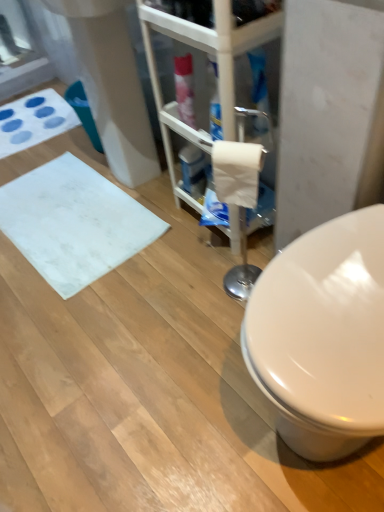
Question: Does white matte bath mat at lower left, the 1th bath mat in the bottom-to-top sequence, appear on the left side of white matte toilet paper at center?

Choices:
 (A) no
 (B) yes

Answer: (B)

Question: Considering the relative sizes of white matte bath mat at lower left, the 1th bath mat viewed from the front, and white matte toilet paper at center in the image provided, is white matte bath mat at lower left, the 1th bath mat viewed from the front, shorter than white matte toilet paper at center?

Choices:
 (A) yes
 (B) no

Answer: (A)

Question: From the image's perspective, is white matte bath mat at lower left, arranged as the second bath mat when viewed from the top, located above white matte toilet paper at center?

Choices:
 (A) yes
 (B) no

Answer: (B)

Question: Considering the relative sizes of white matte bath mat at lower left, the 1th bath mat in the bottom-to-top sequence, and white matte toilet paper at center in the image provided, is white matte bath mat at lower left, the 1th bath mat in the bottom-to-top sequence, smaller than white matte toilet paper at center?

Choices:
 (A) yes
 (B) no

Answer: (B)

Question: Is white matte toilet paper at center completely or partially inside white matte bath mat at lower left, which is counted as the second bath mat, starting from the back?

Choices:
 (A) yes
 (B) no

Answer: (B)

Question: From a real-world perspective, is white plastic shelf at center physically located above or below white matte bath mat at upper left, the first bath mat when ordered from back to front?

Choices:
 (A) below
 (B) above

Answer: (B)

Question: Considering the positions of white plastic shelf at center and white matte bath mat at upper left, the 2th bath mat when ordered from bottom to top, in the image, is white plastic shelf at center bigger or smaller than white matte bath mat at upper left, the 2th bath mat when ordered from bottom to top,?

Choices:
 (A) small
 (B) big

Answer: (B)

Question: Relative to white matte bath mat at upper left, placed as the first bath mat when sorted from top to bottom, is white plastic shelf at center in front or behind?

Choices:
 (A) front
 (B) behind

Answer: (A)

Question: In the image, is white plastic shelf at center on the left side or the right side of white matte bath mat at upper left, positioned as the 2th bath mat in front-to-back order?

Choices:
 (A) left
 (B) right

Answer: (B)

Question: From a real-world perspective, is white matte bath mat at lower left, arranged as the second bath mat when viewed from the top, physically located above or below white plastic shelf at center?

Choices:
 (A) above
 (B) below

Answer: (B)

Question: Considering the positions of white matte bath mat at lower left, arranged as the second bath mat when viewed from the top, and white plastic shelf at center in the image, is white matte bath mat at lower left, arranged as the second bath mat when viewed from the top, wider or thinner than white plastic shelf at center?

Choices:
 (A) wide
 (B) thin

Answer: (A)

Question: From the image's perspective, is white matte bath mat at lower left, arranged as the second bath mat when viewed from the top, positioned above or below white plastic shelf at center?

Choices:
 (A) above
 (B) below

Answer: (B)

Question: Is white matte bath mat at lower left, arranged as the second bath mat when viewed from the top, situated inside white plastic shelf at center or outside?

Choices:
 (A) inside
 (B) outside

Answer: (B)

Question: Does point (8, 103) appear closer or farther from the camera than point (230, 165)?

Choices:
 (A) farther
 (B) closer

Answer: (A)

Question: From a real-world perspective, is white matte bath mat at upper left, positioned as the 2th bath mat in front-to-back order, above or below white matte toilet paper at center?

Choices:
 (A) above
 (B) below

Answer: (B)